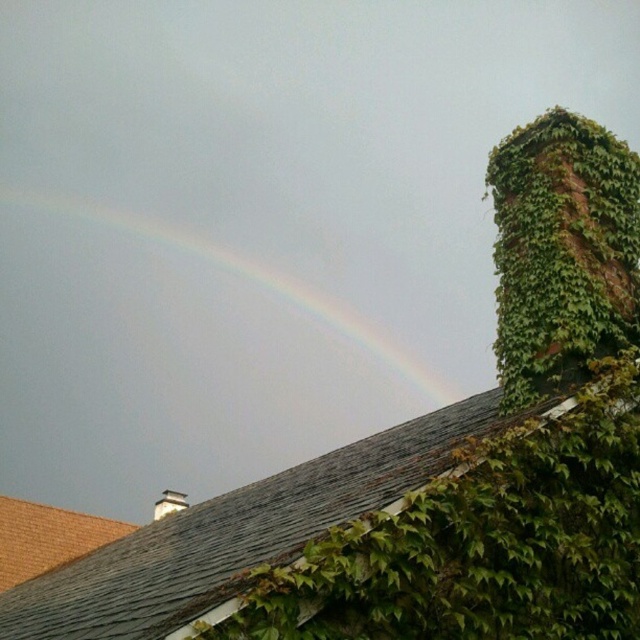
Can you confirm if rainbow at upper left is positioned above white brick chimney at upper center?

Indeed, rainbow at upper left is positioned over white brick chimney at upper center.

Which is behind, point (376, 328) or point (179, 509)?

Point (376, 328)

Where is `rainbow at upper left`? This screenshot has width=640, height=640. rainbow at upper left is located at coordinates point(243,276).

Who is higher up, green leafy ivy at upper right or rainbow at upper left?

rainbow at upper left is higher up.

The width and height of the screenshot is (640, 640). Describe the element at coordinates (563, 252) in the screenshot. I see `green leafy ivy at upper right` at that location.

Where is `green leafy ivy at upper right`? The image size is (640, 640). green leafy ivy at upper right is located at coordinates (563, 252).

Who is more distant from viewer, [600,339] or [160,513]?

The point [160,513] is more distant.

Does green leafy ivy at upper right come behind white brick chimney at upper center?

No.

Looking at this image, who is more distant from viewer, [593,195] or [166,502]?

The point [166,502] is more distant.

Where is `green leafy ivy at upper right`? This screenshot has width=640, height=640. green leafy ivy at upper right is located at coordinates (563, 252).